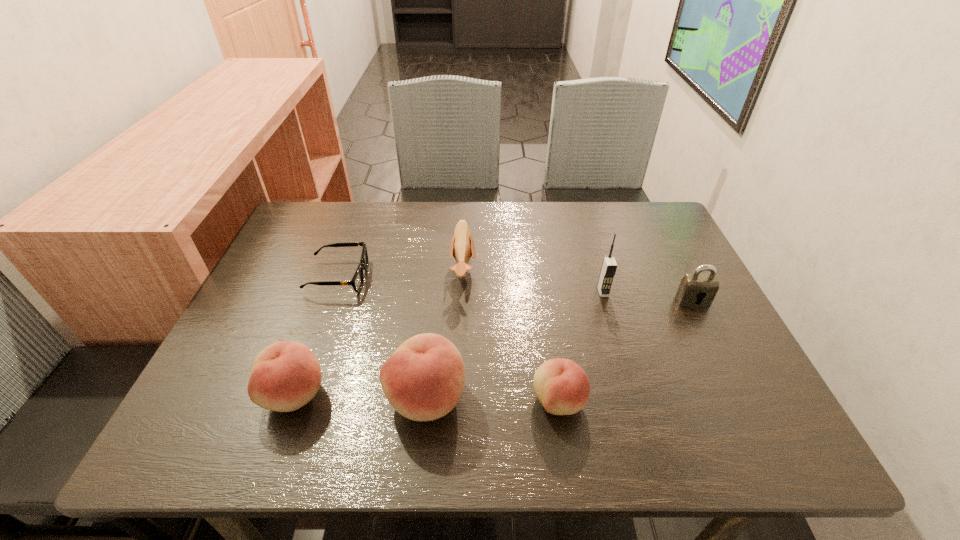
Image resolution: width=960 pixels, height=540 pixels. I want to click on vacant space located 0.160m on the left of the sixth shortest object, so click(x=305, y=397).

The image size is (960, 540). I want to click on vacant area located on the left of the second shortest object, so (451, 401).

I want to click on free space located 0.250m on the front-facing side of the sunglasses, so click(465, 277).

The width and height of the screenshot is (960, 540). Find the location of `blank space located 0.320m at the beak of the bird`. blank space located 0.320m at the beak of the bird is located at coordinates (598, 271).

The height and width of the screenshot is (540, 960). I want to click on vacant space located on the front-facing side of the cellular telephone, so click(x=613, y=325).

Find the location of a particular element. This screenshot has width=960, height=540. blank space located at the front of the rightmost object near the keyhole is located at coordinates (728, 369).

You are a GUI agent. You are given a task and a screenshot of the screen. Output one action in this format:
    pyautogui.click(x=<x>, y=<y>)
    Task: Click on the object that is at the far edge
    The height and width of the screenshot is (540, 960).
    Given the screenshot: What is the action you would take?
    pyautogui.click(x=462, y=244)

At what (x,y) coordinates should I click in order to perform the action: click on peach at the left edge. Please return your answer as a coordinate pair (x, y). The width and height of the screenshot is (960, 540). Looking at the image, I should click on (286, 375).

This screenshot has width=960, height=540. I want to click on sunglasses located at the left edge, so click(357, 281).

The image size is (960, 540). In order to click on object at the right edge in this screenshot , I will do `click(696, 289)`.